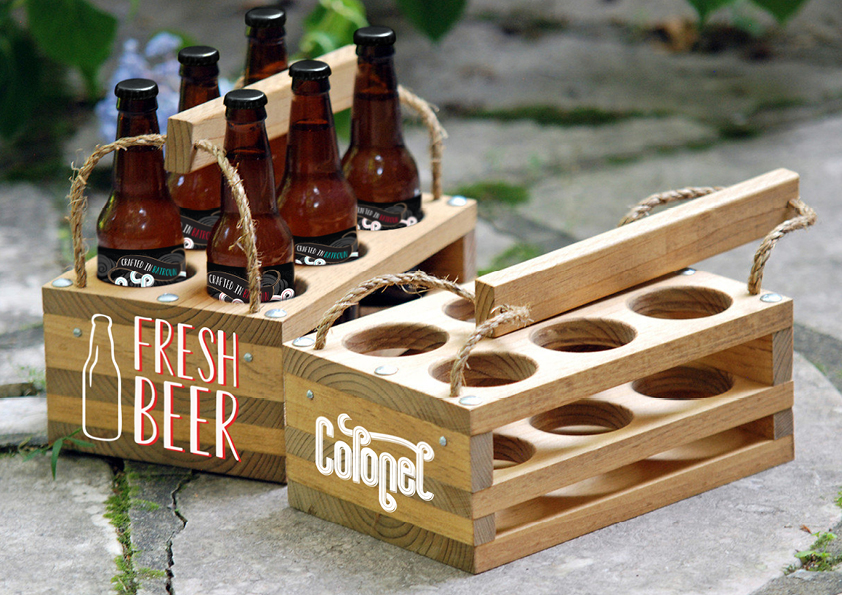
Locate an element on the screen. cup is located at coordinates (605, 337).